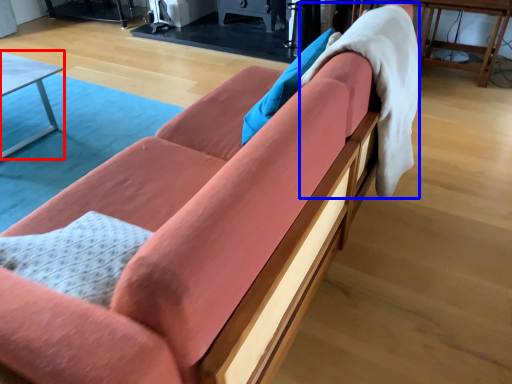
Question: Which of the following is the closest to the observer, table (highlighted by a red box) or blanket (highlighted by a blue box)?

Choices:
 (A) table
 (B) blanket

Answer: (B)